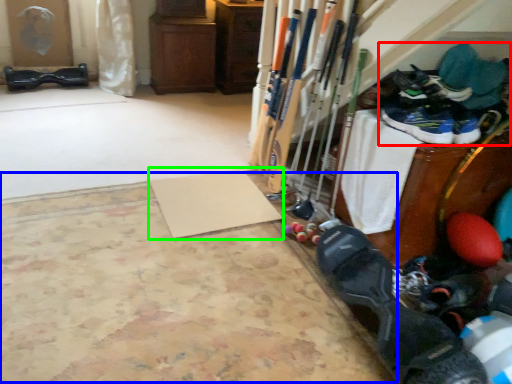
Question: Considering the real-world distances, which object is closest to footwear (highlighted by a red box)? yoga mat (highlighted by a blue box) or yoga mat (highlighted by a green box).

Choices:
 (A) yoga mat
 (B) yoga mat

Answer: (B)